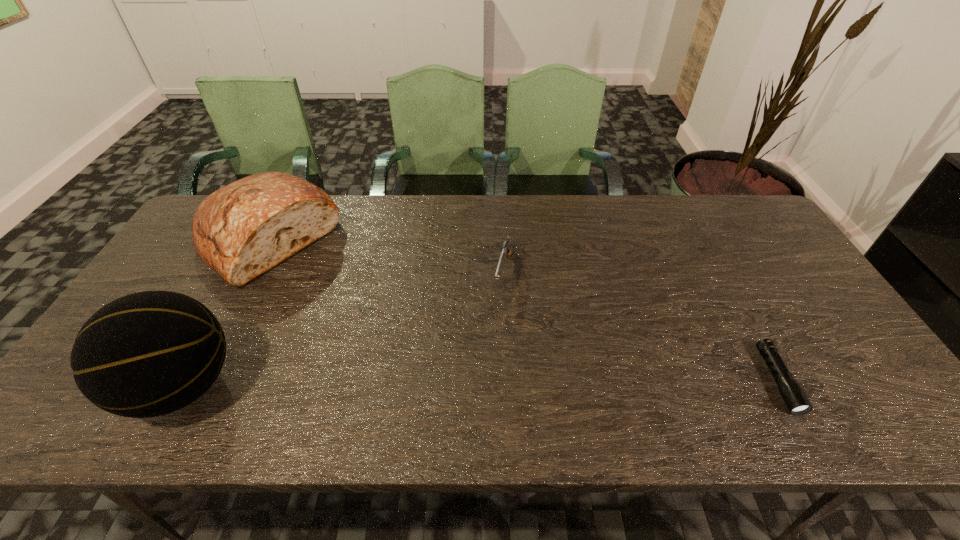
I want to click on vacant area that lies between the rightmost object and the tallest object, so click(x=480, y=383).

The width and height of the screenshot is (960, 540). I want to click on free space that is in between the third tallest object and the rightmost object, so point(640,326).

Image resolution: width=960 pixels, height=540 pixels. Find the location of `vacant space that is in between the basketball and the bread`. vacant space that is in between the basketball and the bread is located at coordinates (226, 313).

Where is `vacant point located between the rightmost object and the tallest object`? vacant point located between the rightmost object and the tallest object is located at coordinates (480, 383).

In order to click on the third closest object to the tallest object in this screenshot , I will do `click(794, 397)`.

This screenshot has height=540, width=960. In order to click on object that is the closest to the basketball in this screenshot , I will do `click(240, 231)`.

Identify the location of vacant region that satisfies the following two spatial constraints: 1. on the back side of the tallest object; 2. on the right side of the second object from right to left. (244, 272).

Find the location of a particular element. The height and width of the screenshot is (540, 960). free point that satisfies the following two spatial constraints: 1. on the back side of the basketball; 2. on the right side of the third shortest object is located at coordinates (262, 239).